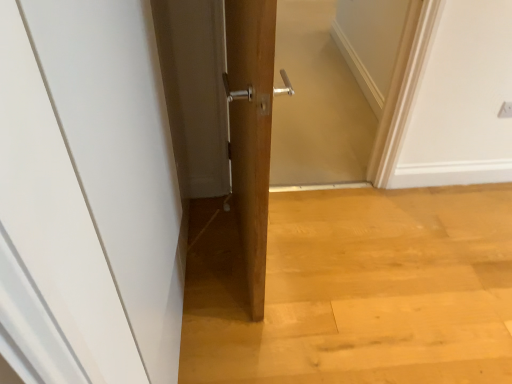
You are a GUI agent. You are given a task and a screenshot of the screen. Output one action in this format:
    pyautogui.click(x=<x>, y=<y>)
    Task: Click on the white plastic electric outlet at upper right
    This screenshot has height=384, width=512.
    Given the screenshot: What is the action you would take?
    pyautogui.click(x=505, y=110)

What's the angular difference between white matte door at center and white plastic electric outlet at upper right's facing directions?

The angular difference between white matte door at center and white plastic electric outlet at upper right is 88 degrees.

Is white matte door at center with white plastic electric outlet at upper right?

white matte door at center is not next to white plastic electric outlet at upper right, and they're not touching.

From a real-world perspective, which object stands above the other?

In real-world perspective, white matte door at center is above.

Can you confirm if white matte door at center is thinner than white plastic electric outlet at upper right?

No.

Considering the points (312, 149) and (506, 117), which point is behind, point (312, 149) or point (506, 117)?

The point (312, 149) is farther.

Is wooden screen door at center oriented away from white plastic electric outlet at upper right?

No, white plastic electric outlet at upper right is not at the back of wooden screen door at center.

Which object is wider, wooden screen door at center or white plastic electric outlet at upper right?

wooden screen door at center.

Which of these two, wooden screen door at center or white plastic electric outlet at upper right, stands taller?

wooden screen door at center.

Which is correct: white matte door at center is inside wooden screen door at center, or outside of it?

white matte door at center exists outside the volume of wooden screen door at center.

At what (x,y) coordinates should I click in order to perform the action: click on screen door located on the right of white matte door at center. Please return your answer as a coordinate pair (x, y). The height and width of the screenshot is (384, 512). Looking at the image, I should click on (338, 87).

In the scene shown: Which object is closer to the camera, white matte door at center or wooden screen door at center?

white matte door at center is more forward.

From the image's perspective, does white matte door at center appear higher than wooden screen door at center?

No, from the image's perspective, white matte door at center is not over wooden screen door at center.

Which of these two, white plastic electric outlet at upper right or white matte door at center, stands taller?

Standing taller between the two is white matte door at center.

Can you confirm if white plastic electric outlet at upper right is thinner than white matte door at center?

Yes, white plastic electric outlet at upper right is thinner than white matte door at center.

Which is behind, white plastic electric outlet at upper right or white matte door at center?

white plastic electric outlet at upper right is behind.

Which is farther from the camera, (504, 109) or (123, 194)?

Point (504, 109)

From the image's perspective, between white plastic electric outlet at upper right and wooden screen door at center, who is located below?

white plastic electric outlet at upper right, from the image's perspective.

Which object is positioned more to the right, white plastic electric outlet at upper right or wooden screen door at center?

white plastic electric outlet at upper right is more to the right.

Would you say white plastic electric outlet at upper right is a long distance from wooden screen door at center?

Yes, white plastic electric outlet at upper right and wooden screen door at center are located far from each other.

Can you confirm if white plastic electric outlet at upper right is shorter than wooden screen door at center?

Yes, white plastic electric outlet at upper right is shorter than wooden screen door at center.

Is white matte door at center at the back of wooden screen door at center?

No, wooden screen door at center is not facing the opposite direction of white matte door at center.

From a real-world perspective, is wooden screen door at center physically above white matte door at center?

Actually, wooden screen door at center is physically below white matte door at center in the real world.

From the image's perspective, is wooden screen door at center positioned above or below white matte door at center?

wooden screen door at center is above white matte door at center.

You are a GUI agent. You are given a task and a screenshot of the screen. Output one action in this format:
    pyautogui.click(x=<x>, y=<y>)
    Task: Click on the electric outlet that appears above the white matte door at center (from the image's perspective)
    Image resolution: width=512 pixels, height=384 pixels.
    Given the screenshot: What is the action you would take?
    pyautogui.click(x=505, y=110)

Locate an element on the screen. This screenshot has height=384, width=512. electric outlet that is under the wooden screen door at center (from a real-world perspective) is located at coordinates click(x=505, y=110).

Estimate the real-world distances between objects in this image. Which object is closer to wooden screen door at center, white plastic electric outlet at upper right or white matte door at center?

white plastic electric outlet at upper right is closer to wooden screen door at center.

From the image, which object appears to be nearer to white matte door at center, wooden screen door at center or white plastic electric outlet at upper right?

wooden screen door at center.

From the image, which object appears to be nearer to white plastic electric outlet at upper right, wooden screen door at center or white matte door at center?

Among the two, wooden screen door at center is located nearer to white plastic electric outlet at upper right.

Looking at the image, which one is located closer to white matte door at center, white plastic electric outlet at upper right or wooden screen door at center?

Among the two, wooden screen door at center is located nearer to white matte door at center.

When comparing their distances from wooden screen door at center, does white matte door at center or white plastic electric outlet at upper right seem closer?

white plastic electric outlet at upper right lies closer to wooden screen door at center than the other object.

Which object lies nearer to the anchor point white plastic electric outlet at upper right, white matte door at center or wooden screen door at center?

wooden screen door at center.

Locate an element on the screen. The image size is (512, 384). screen door positioned between white matte door at center and white plastic electric outlet at upper right from near to far is located at coordinates (338, 87).